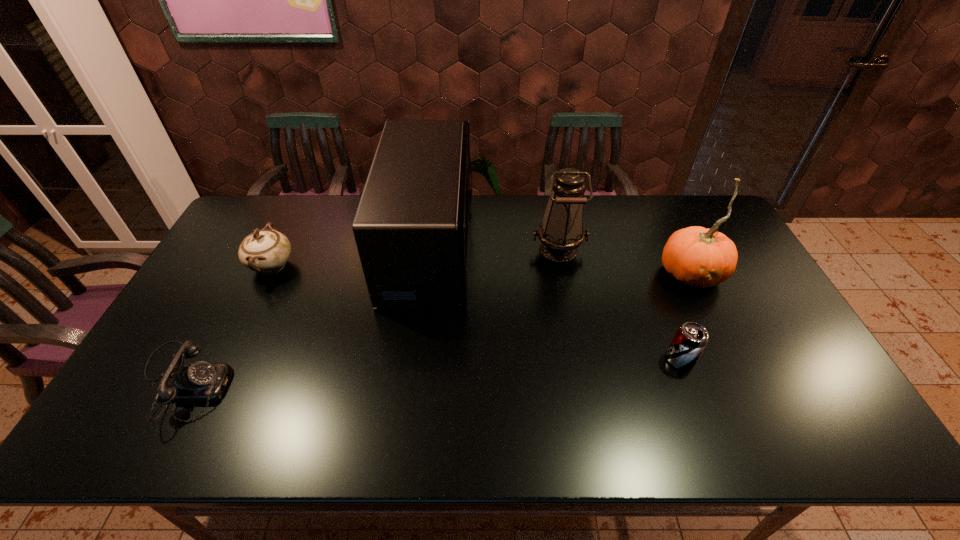
The width and height of the screenshot is (960, 540). Find the location of `vacant area that lies between the telephone and the chinaware`. vacant area that lies between the telephone and the chinaware is located at coordinates (227, 324).

The height and width of the screenshot is (540, 960). I want to click on the third closest object relative to the telephone, so click(x=561, y=231).

Point out which object is positioned as the fourth nearest to the telephone. Please provide its 2D coordinates. Your answer should be formatted as a tuple, i.e. [(x, y)], where the tuple contains the x and y coordinates of a point satisfying the conditions above.

[(690, 340)]

At what (x,y) coordinates should I click in order to perform the action: click on vacant point that satisfies the following two spatial constraints: 1. on the back side of the oil lamp; 2. on the front-facing side of the third object from left to right. Please return your answer as a coordinate pair (x, y). The width and height of the screenshot is (960, 540). Looking at the image, I should click on (558, 246).

The height and width of the screenshot is (540, 960). I want to click on free space that satisfies the following two spatial constraints: 1. on the front-facing side of the third object from right to left; 2. on the left side of the fourth object from right to left, so click(x=429, y=249).

What are the coordinates of `vacant space that satisfies the following two spatial constraints: 1. on the front-facing side of the fourth object from right to left; 2. on the back side of the fourth object from left to right` in the screenshot? It's located at (429, 249).

Find the location of a particular element. The height and width of the screenshot is (540, 960). free space that satisfies the following two spatial constraints: 1. on the front-facing side of the pumpkin; 2. on the left side of the microwave_oven is located at coordinates (426, 274).

This screenshot has width=960, height=540. What are the coordinates of `vacant area that satisfies the following two spatial constraints: 1. on the front side of the third object from right to left; 2. on the front-facing side of the shortest object` in the screenshot? It's located at (584, 383).

Image resolution: width=960 pixels, height=540 pixels. I want to click on vacant space that satisfies the following two spatial constraints: 1. on the front-facing side of the fifth tallest object; 2. on the right side of the third object from left to right, so click(x=416, y=360).